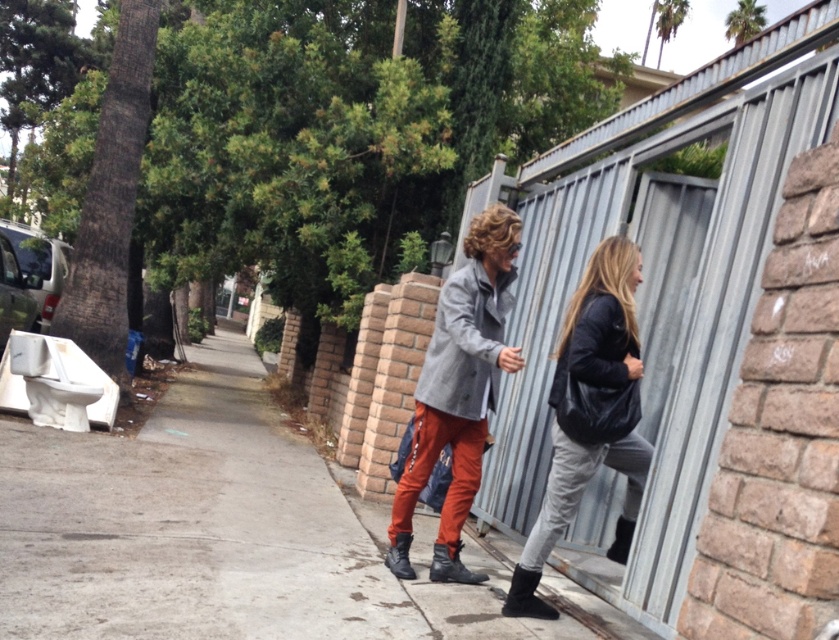
Between point (268, 426) and point (586, 324), which one is positioned in front?

Point (586, 324) is more forward.

Can you confirm if concrete sidewalk at center is positioned to the left of black leather jacket at right?

Yes, concrete sidewalk at center is to the left of black leather jacket at right.

Is point (134, 620) positioned behind point (638, 376)?

No, it is not.

What are the coordinates of `concrete sidewalk at center` in the screenshot? It's located at (227, 532).

Which is more to the left, concrete sidewalk at center or matte gray coat at center?

concrete sidewalk at center is more to the left.

Does concrete sidewalk at center appear under matte gray coat at center?

Yes.

You are a GUI agent. You are given a task and a screenshot of the screen. Output one action in this format:
    pyautogui.click(x=<x>, y=<y>)
    Task: Click on the concrete sidewalk at center
    Image resolution: width=839 pixels, height=640 pixels.
    Given the screenshot: What is the action you would take?
    (x=227, y=532)

Where is `black leather jacket at right`? black leather jacket at right is located at coordinates (590, 413).

The image size is (839, 640). What do you see at coordinates (590, 413) in the screenshot? I see `black leather jacket at right` at bounding box center [590, 413].

You are a GUI agent. You are given a task and a screenshot of the screen. Output one action in this format:
    pyautogui.click(x=<x>, y=<y>)
    Task: Click on the black leather jacket at right
    This screenshot has height=640, width=839.
    Given the screenshot: What is the action you would take?
    pyautogui.click(x=590, y=413)